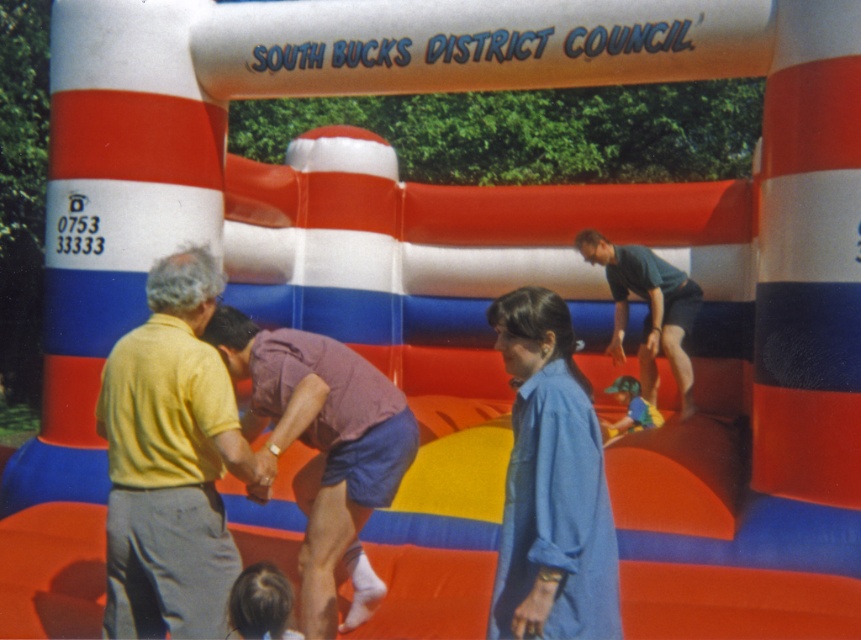
Question: Does matte purple shirt at center appear over dark green t-shirt at upper right?

Choices:
 (A) yes
 (B) no

Answer: (B)

Question: Observing the image, what is the correct spatial positioning of blue cotton shirt at center in reference to matte purple shirt at center?

Choices:
 (A) below
 (B) above

Answer: (B)

Question: Which object appears closest to the camera in this image?

Choices:
 (A) blonde hair at lower left
 (B) dark green t-shirt at upper right

Answer: (A)

Question: Does blue cotton shirt at center have a smaller size compared to matte purple shirt at center?

Choices:
 (A) no
 (B) yes

Answer: (B)

Question: Which of the following is the closest to the observer?

Choices:
 (A) blonde hair at lower left
 (B) yellow matte shirt at left

Answer: (A)

Question: Which of the following is the farthest from the observer?

Choices:
 (A) blonde hair at lower left
 (B) yellow matte shirt at left
 (C) blue fabric shirt at center
 (D) matte purple shirt at center

Answer: (C)